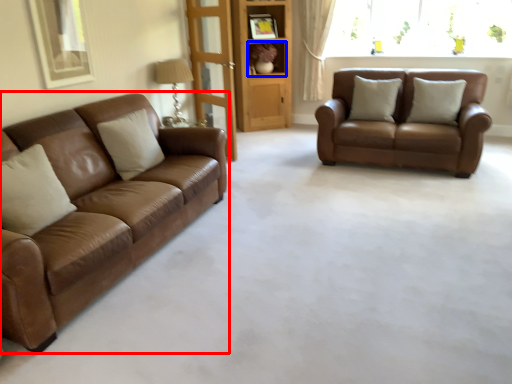
Question: Which of the following is the closest to the observer, studio couch (highlighted by a red box) or shelf (highlighted by a blue box)?

Choices:
 (A) studio couch
 (B) shelf

Answer: (A)